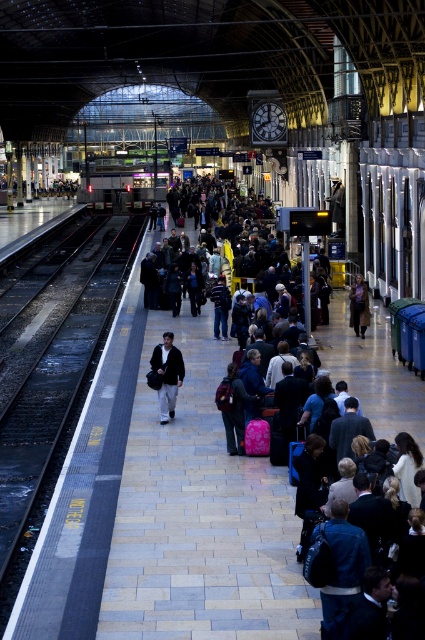
Question: Which object appears farthest from the camera in this image?

Choices:
 (A) dark gray sweater at center
 (B) black asphalt train track at left
 (C) dark gray fabric crowd at center
 (D) dark brown leather jacket at center

Answer: (D)

Question: Can you confirm if dark gray fabric crowd at center is positioned to the right of black asphalt train track at left?

Choices:
 (A) yes
 (B) no

Answer: (A)

Question: Can you confirm if metallic silver train at center is positioned above dark brown leather jacket at center?

Choices:
 (A) yes
 (B) no

Answer: (A)

Question: Which object appears closest to the camera in this image?

Choices:
 (A) dark gray sweater at center
 (B) dark brown leather jacket at center
 (C) black asphalt train track at left

Answer: (C)

Question: Which point is farther from the camera taking this photo?

Choices:
 (A) (6, 586)
 (B) (119, 172)

Answer: (B)

Question: Can you confirm if metallic silver train at center is positioned to the right of dark brown leather jacket at center?

Choices:
 (A) no
 (B) yes

Answer: (A)